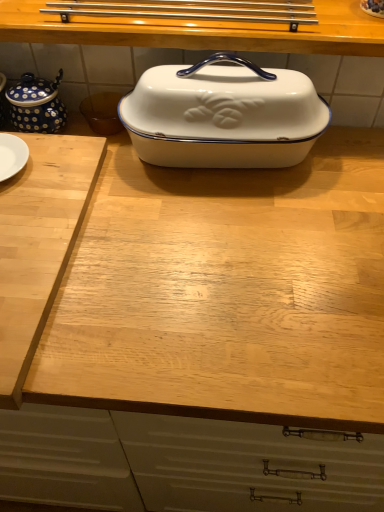
Question: Considering the relative sizes of light wood cutting board at left and blue polka dot ceramic jar at upper left in the image provided, is light wood cutting board at left shorter than blue polka dot ceramic jar at upper left?

Choices:
 (A) no
 (B) yes

Answer: (B)

Question: Can you confirm if light wood cutting board at left is wider than blue polka dot ceramic jar at upper left?

Choices:
 (A) no
 (B) yes

Answer: (B)

Question: Is light wood cutting board at left far away from blue polka dot ceramic jar at upper left?

Choices:
 (A) no
 (B) yes

Answer: (A)

Question: Is blue polka dot ceramic jar at upper left surrounded by light wood cutting board at left?

Choices:
 (A) no
 (B) yes

Answer: (A)

Question: From the image's perspective, is light wood cutting board at left under blue polka dot ceramic jar at upper left?

Choices:
 (A) yes
 (B) no

Answer: (A)

Question: Is light wood cutting board at left at the left side of blue polka dot ceramic jar at upper left?

Choices:
 (A) no
 (B) yes

Answer: (B)

Question: Is light wood cutting board at left to the right of white glossy enamel dish at center from the viewer's perspective?

Choices:
 (A) no
 (B) yes

Answer: (A)

Question: Can you confirm if light wood cutting board at left is taller than white glossy enamel dish at center?

Choices:
 (A) yes
 (B) no

Answer: (B)

Question: Is the position of light wood cutting board at left less distant than that of white glossy enamel dish at center?

Choices:
 (A) yes
 (B) no

Answer: (A)

Question: Is light wood cutting board at left directly adjacent to white glossy enamel dish at center?

Choices:
 (A) no
 (B) yes

Answer: (A)

Question: Is white glossy enamel dish at center located within light wood cutting board at left?

Choices:
 (A) yes
 (B) no

Answer: (B)

Question: Is light wood cutting board at left at the left side of white glossy enamel dish at center?

Choices:
 (A) yes
 (B) no

Answer: (A)

Question: From the image's perspective, does white enamel casserole dish at center appear higher than light wood cutting board at left?

Choices:
 (A) no
 (B) yes

Answer: (B)